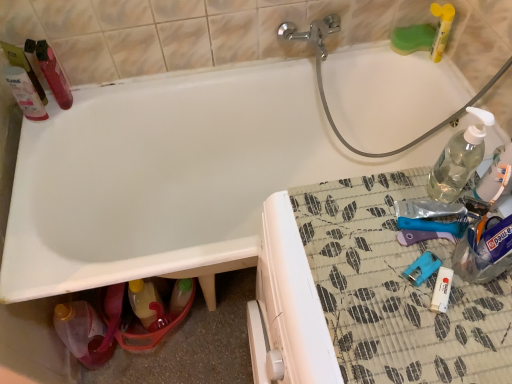
Where is `vacant area that is in front of translucent plastic bottles at upper left`? The height and width of the screenshot is (384, 512). vacant area that is in front of translucent plastic bottles at upper left is located at coordinates (31, 145).